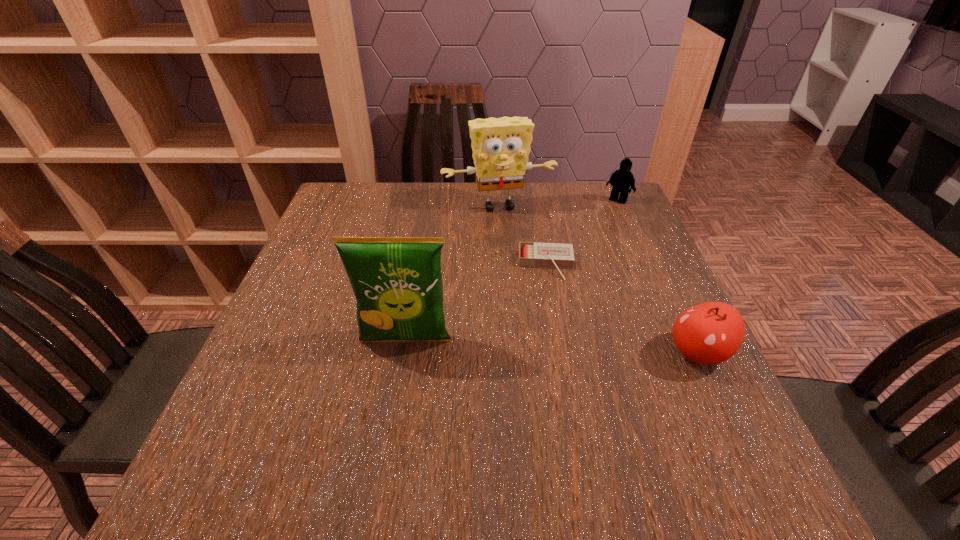
Identify the location of vacant spot on the desktop that is between the crisp (potato chip) and the apple and is positioned on the face of the sponge. This screenshot has width=960, height=540. (548, 347).

You are a GUI agent. You are given a task and a screenshot of the screen. Output one action in this format:
    pyautogui.click(x=<x>, y=<y>)
    Task: Click on the free space on the desktop that is between the crisp (potato chip) and the apple and is positioned on the striking surface of the shortest object
    
    Given the screenshot: What is the action you would take?
    point(552,347)

Locate an element on the screen. The image size is (960, 540). vacant space on the desktop that is between the crisp (potato chip) and the apple and is positioned on the face of the Lego is located at coordinates (507, 345).